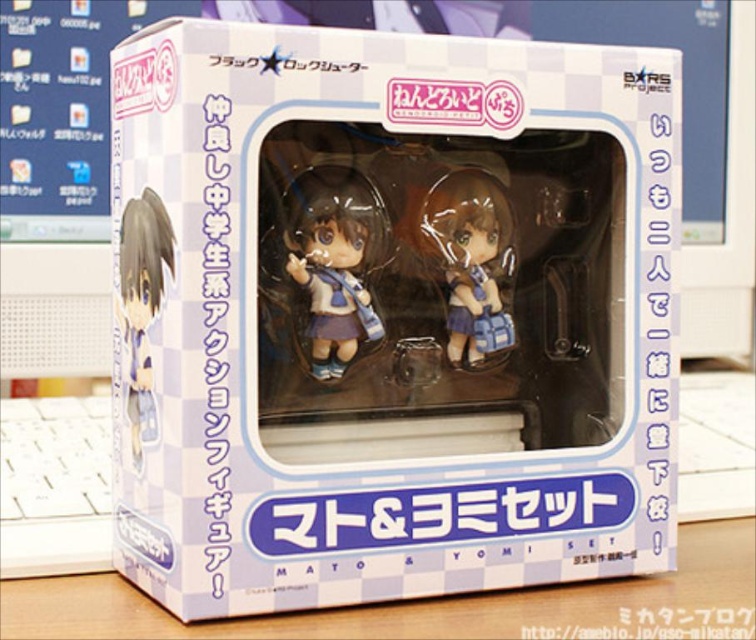
In the scene shown: Which is more to the left, wooden table at center or matte plastic figurine at center?

Positioned to the left is wooden table at center.

Does wooden table at center lie in front of matte plastic figurine at center?

Yes, wooden table at center is closer to the viewer.

Identify the location of wooden table at center. (429, 604).

Who is taller, satin blue doll at center or matte plastic figurine at center?

satin blue doll at center is taller.

Is point (370, 186) farther from camera compared to point (510, 259)?

No, it is in front of (510, 259).

What do you see at coordinates (333, 260) in the screenshot?
I see `satin blue doll at center` at bounding box center [333, 260].

This screenshot has width=756, height=640. What are the coordinates of `satin blue doll at center` in the screenshot? It's located at (333, 260).

How much distance is there between white glossy box at center and matte blue plastic figurine at left?

white glossy box at center is 7.88 inches from matte blue plastic figurine at left.

Between white glossy box at center and matte blue plastic figurine at left, which one appears on the right side from the viewer's perspective?

From the viewer's perspective, white glossy box at center appears more on the right side.

Between point (555, 497) and point (129, 285), which one is positioned in front?

Point (129, 285)

Find the location of a particular element. The width and height of the screenshot is (756, 640). white glossy box at center is located at coordinates (389, 314).